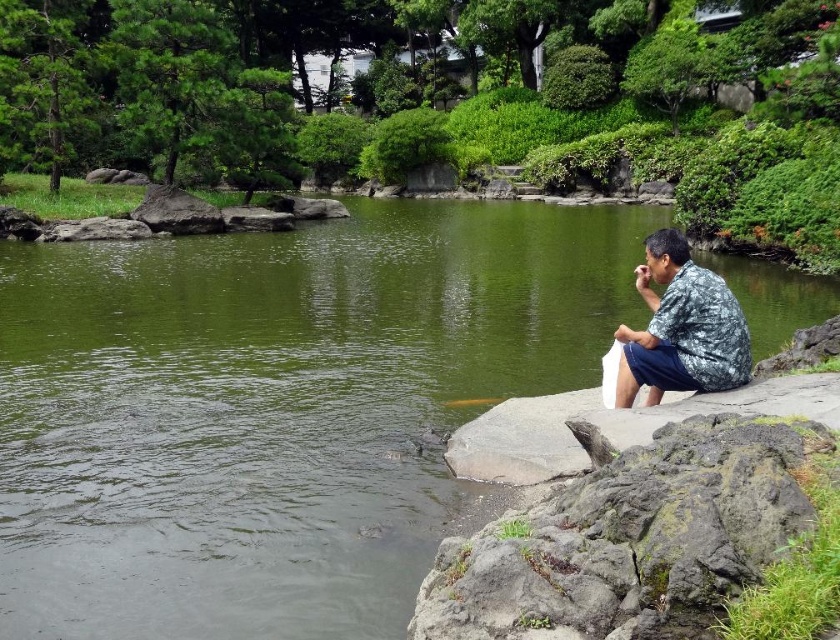
Question: Where is green water at center located in relation to camouflage fabric shirt at right in the image?

Choices:
 (A) left
 (B) right

Answer: (A)

Question: Which point is closer to the camera?

Choices:
 (A) (694, 339)
 (B) (465, 324)

Answer: (A)

Question: Can you confirm if green water at center is positioned above camouflage fabric shirt at right?

Choices:
 (A) no
 (B) yes

Answer: (B)

Question: Which of the following is the farthest from the observer?

Choices:
 (A) (116, 467)
 (B) (747, 353)

Answer: (A)

Question: Which point is farther to the camera?

Choices:
 (A) (697, 360)
 (B) (291, 602)

Answer: (A)

Question: Can you confirm if green water at center is smaller than camouflage fabric shirt at right?

Choices:
 (A) yes
 (B) no

Answer: (B)